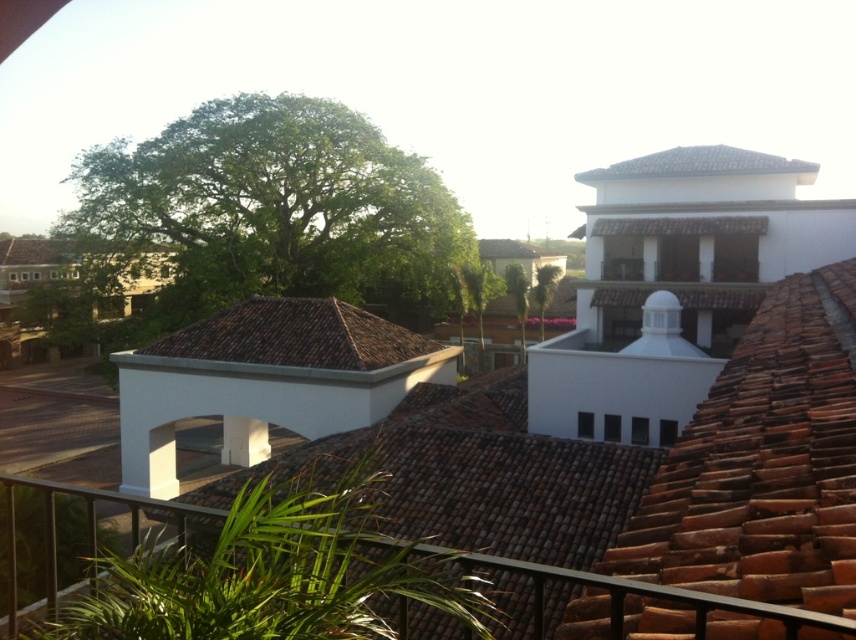
Question: Considering the real-world distances, which object is farthest from the metallic gray railing at lower center?

Choices:
 (A) brown tile roof at upper center
 (B) brown tile roof at center

Answer: (A)

Question: Which point appears farthest from the camera in this image?

Choices:
 (A) (809, 624)
 (B) (405, 337)
 (C) (721, 147)

Answer: (C)

Question: Does metallic gray railing at lower center lie behind brown tile roof at upper center?

Choices:
 (A) yes
 (B) no

Answer: (B)

Question: Does metallic gray railing at lower center have a larger size compared to brown tile roof at center?

Choices:
 (A) no
 (B) yes

Answer: (B)

Question: Among these points, which one is farthest from the camera?

Choices:
 (A) (690, 150)
 (B) (194, 356)
 (C) (492, 556)

Answer: (A)

Question: Where is brown tile roof at center located in relation to brown tile roof at upper center in the image?

Choices:
 (A) above
 (B) below

Answer: (B)